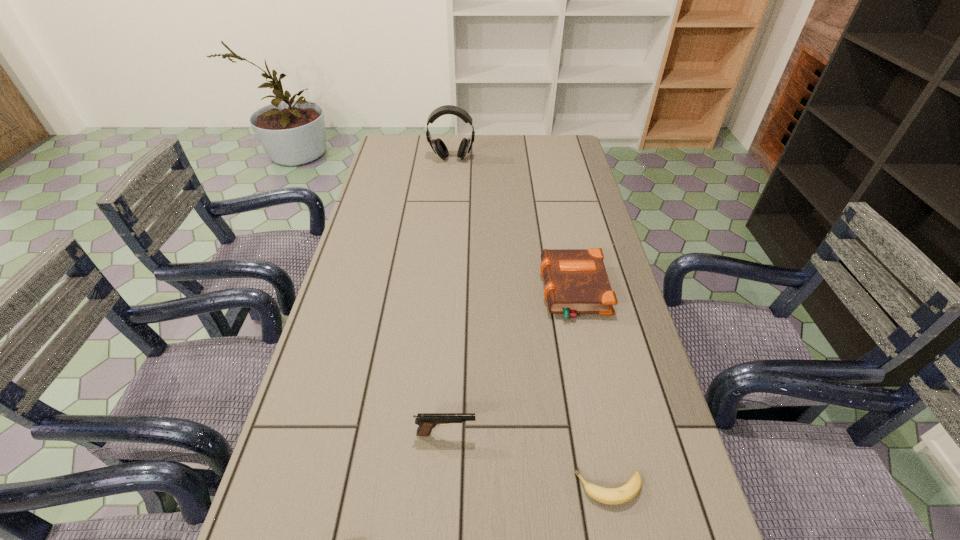
Locate an element on the screen. The image size is (960, 540). free space at the left edge of the desktop is located at coordinates (375, 274).

At what (x,y) coordinates should I click in order to perform the action: click on blank space at the right edge of the desktop. Please return your answer as a coordinate pair (x, y). The image size is (960, 540). Looking at the image, I should click on click(x=644, y=438).

At what (x,y) coordinates should I click in order to perform the action: click on free spot at the far left corner of the desktop. Please return your answer as a coordinate pair (x, y). The width and height of the screenshot is (960, 540). Looking at the image, I should click on (413, 149).

The height and width of the screenshot is (540, 960). I want to click on free space that is in between the pistol and the banana, so click(x=528, y=461).

Identify the location of free space between the farthest object and the third shortest object. (449, 296).

In order to click on vacant area that lies between the second shortest object and the farthest object in this screenshot , I will do `click(513, 225)`.

Find the location of a particular element. The image size is (960, 540). free spot between the earphone and the shortest object is located at coordinates (531, 323).

This screenshot has width=960, height=540. I want to click on free spot between the shortest object and the Bible, so click(591, 389).

Locate an element on the screen. The height and width of the screenshot is (540, 960). object that is the third closest one to the tallest object is located at coordinates (613, 496).

Where is `object that is the closest one to the third tallest object`? object that is the closest one to the third tallest object is located at coordinates (427, 421).